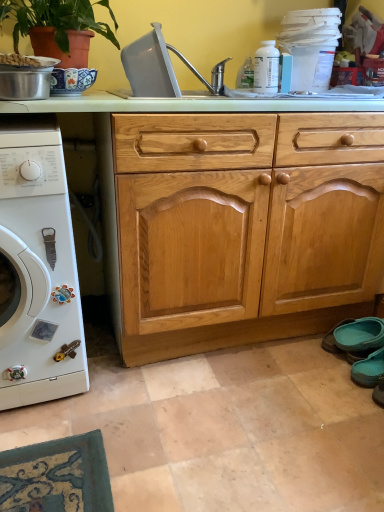
Question: Is white matte washing machine at left facing towards metallic silver pot at upper left?

Choices:
 (A) no
 (B) yes

Answer: (A)

Question: Is white matte washing machine at left further to the viewer compared to metallic silver pot at upper left?

Choices:
 (A) no
 (B) yes

Answer: (A)

Question: Is white matte washing machine at left in contact with metallic silver pot at upper left?

Choices:
 (A) no
 (B) yes

Answer: (A)

Question: Is white matte washing machine at left taller than metallic silver pot at upper left?

Choices:
 (A) yes
 (B) no

Answer: (A)

Question: Are white matte washing machine at left and metallic silver pot at upper left far apart?

Choices:
 (A) no
 (B) yes

Answer: (A)

Question: From a real-world perspective, is terracotta clay pot at upper left physically located above or below teal fabric shoe at lower right, which is the 1th shoe in back-to-front order?

Choices:
 (A) below
 (B) above

Answer: (B)

Question: Considering the positions of terracotta clay pot at upper left and teal fabric shoe at lower right, placed as the second shoe when sorted from front to back, in the image, is terracotta clay pot at upper left wider or thinner than teal fabric shoe at lower right, placed as the second shoe when sorted from front to back,?

Choices:
 (A) wide
 (B) thin

Answer: (A)

Question: Looking at the image, does terracotta clay pot at upper left seem bigger or smaller compared to teal fabric shoe at lower right, which is the 1th shoe in back-to-front order?

Choices:
 (A) big
 (B) small

Answer: (A)

Question: From the image's perspective, relative to teal fabric shoe at lower right, placed as the second shoe when sorted from front to back, is terracotta clay pot at upper left above or below?

Choices:
 (A) above
 (B) below

Answer: (A)

Question: Is gray plastic sink at upper center in front of or behind light wood/texture drawer at center in the image?

Choices:
 (A) behind
 (B) front

Answer: (A)

Question: Is point (201, 80) positioned closer to the camera than point (274, 130)?

Choices:
 (A) farther
 (B) closer

Answer: (A)

Question: Considering the relative positions of gray plastic sink at upper center and light wood/texture drawer at center in the image provided, is gray plastic sink at upper center to the left or to the right of light wood/texture drawer at center?

Choices:
 (A) left
 (B) right

Answer: (A)

Question: Is gray plastic sink at upper center bigger or smaller than light wood/texture drawer at center?

Choices:
 (A) small
 (B) big

Answer: (A)

Question: Would you say light wood/texture drawer at center is to the left or to the right of gray plastic sink at upper center in the picture?

Choices:
 (A) right
 (B) left

Answer: (A)

Question: Is light wood/texture drawer at center taller or shorter than gray plastic sink at upper center?

Choices:
 (A) tall
 (B) short

Answer: (B)